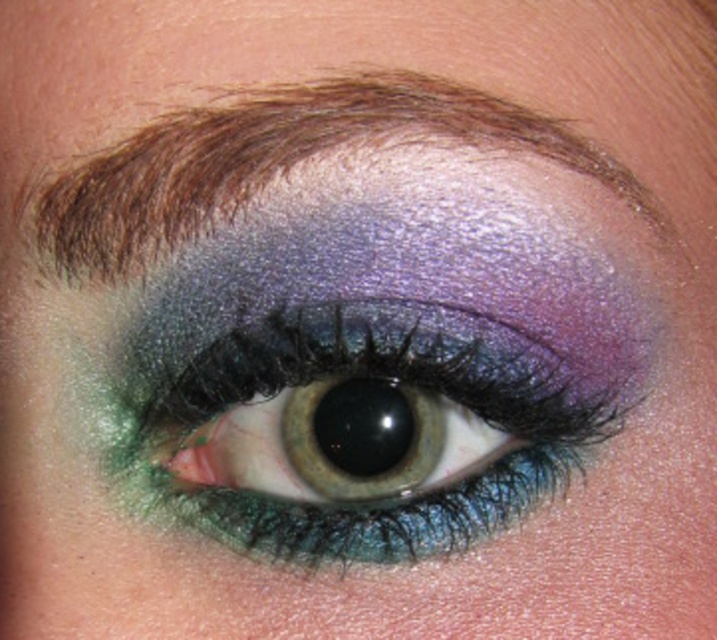
Is shimmering metallic eye at center wider than shiny brown eyebrow at upper center?

In fact, shimmering metallic eye at center might be narrower than shiny brown eyebrow at upper center.

In the scene shown: Is shimmering metallic eye at center positioned behind shiny brown eyebrow at upper center?

Yes, it is.

Find the location of a particular element. The height and width of the screenshot is (640, 717). shimmering metallic eye at center is located at coordinates (346, 378).

The width and height of the screenshot is (717, 640). Identify the location of shimmering metallic eye at center. (346, 378).